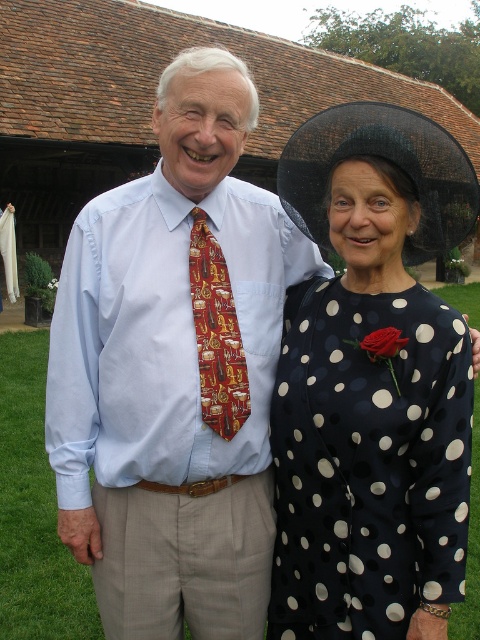
You are a photographer setting up for a formal event. You need to position a spotlight to the right of the black dotted dress at center and to the left of the matte red rose at upper right. Is this possible based on their positions?

The black dotted dress at center is to the left of the matte red rose at upper right, so placing the spotlight between them to the right of the dress and to the left of the rose is possible.

Based on the photo, you are a photographer who needs to capture a closeup shot of the matte silk tie at center and the matte red rose at upper right. Which object should you focus on first if you want to ensure both are in focus without moving the camera?

The matte silk tie at center is positioned on the left side of matte red rose at upper right. To keep both in focus, focus on the matte silk tie at center first since it is closer to the camera than the matte red rose at upper right.